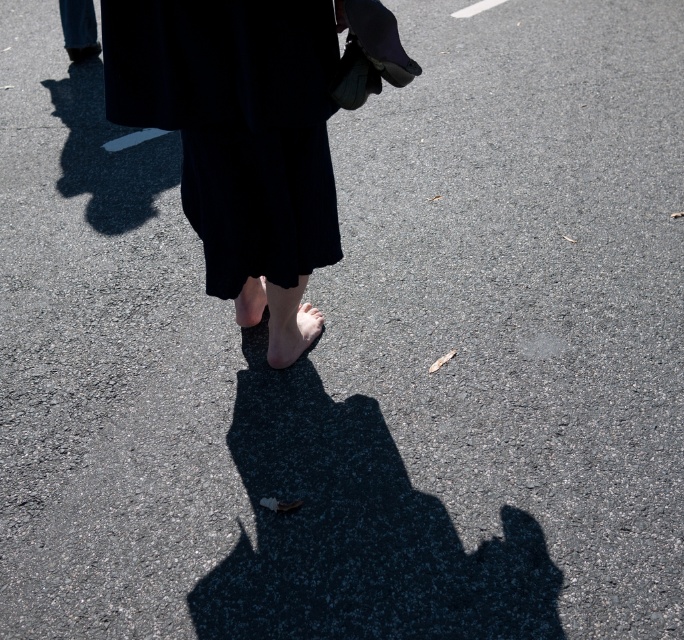
Question: Is black matte dress at center smaller than matte skin foot at center?

Choices:
 (A) no
 (B) yes

Answer: (A)

Question: Can you confirm if barefoot at center is wider than matte skin foot at center?

Choices:
 (A) no
 (B) yes

Answer: (B)

Question: Which of the following is the closest to the observer?

Choices:
 (A) (250, 307)
 (B) (280, 333)

Answer: (B)

Question: Based on their relative distances, which object is nearer to the matte skin foot at center?

Choices:
 (A) barefoot at center
 (B) black matte dress at center

Answer: (A)

Question: Among these objects, which one is nearest to the camera?

Choices:
 (A) barefoot at center
 (B) black matte dress at center
 (C) matte skin foot at center

Answer: (B)

Question: Can you confirm if black matte dress at center is smaller than barefoot at center?

Choices:
 (A) no
 (B) yes

Answer: (A)